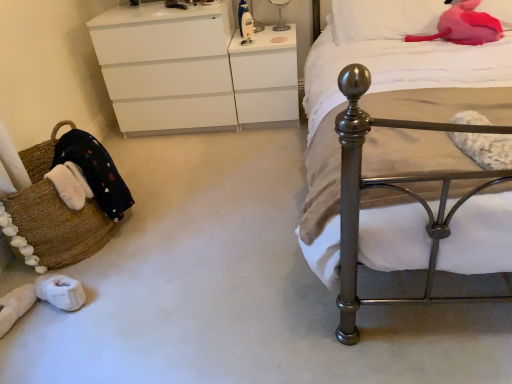
Find the location of a particular element. white glossy changing table at upper center is located at coordinates (265, 78).

Describe the element at coordinates (402, 150) in the screenshot. I see `polished metal bed at right` at that location.

Where is `white matte chest of drawers at upper left`? The image size is (512, 384). white matte chest of drawers at upper left is located at coordinates (191, 71).

From a real-world perspective, count 1st pillows upward from the polished metal bed at right and point to it. Please provide its 2D coordinates.

[(498, 11)]

Would you say pink plush pillow at upper right, which is the first pillow from right to left, contains polished metal bed at right?

Definitely not — polished metal bed at right is not inside pink plush pillow at upper right, which is the first pillow from right to left.

From a real-world perspective, relative to polished metal bed at right, is pink plush pillow at upper right, marked as the second pillow in a left-to-right arrangement, vertically above or below?

pink plush pillow at upper right, marked as the second pillow in a left-to-right arrangement, is situated higher than polished metal bed at right in the real world.

Would you say white glossy changing table at upper center is to the left or to the right of polished metal bed at right in the picture?

white glossy changing table at upper center is to the left of polished metal bed at right.

Is white glossy changing table at upper center spatially inside polished metal bed at right, or outside of it?

white glossy changing table at upper center is outside polished metal bed at right.

Which object is thinner, white glossy changing table at upper center or polished metal bed at right?

white glossy changing table at upper center is thinner.

Is white glossy changing table at upper center smaller than polished metal bed at right?

Correct, white glossy changing table at upper center occupies less space than polished metal bed at right.

Consider the image. Considering the relative positions of transparent glass lamp at upper center and polished metal bed at right in the image provided, is transparent glass lamp at upper center in front of polished metal bed at right?

No, it is behind polished metal bed at right.

Which is more to the left, transparent glass lamp at upper center or polished metal bed at right?

From the viewer's perspective, transparent glass lamp at upper center appears more on the left side.

From a real-world perspective, is transparent glass lamp at upper center on polished metal bed at right?

Correct, in the physical world, transparent glass lamp at upper center is higher than polished metal bed at right.

Would you say transparent glass lamp at upper center contains polished metal bed at right?

That's incorrect, polished metal bed at right is not inside transparent glass lamp at upper center.

From the image's perspective, which is below, transparent glass lamp at upper center or white glossy changing table at upper center?

white glossy changing table at upper center, from the image's perspective.

Is transparent glass lamp at upper center not within white glossy changing table at upper center?

Indeed, transparent glass lamp at upper center is completely outside white glossy changing table at upper center.

Is white glossy changing table at upper center at the back of transparent glass lamp at upper center?

No, transparent glass lamp at upper center is not facing the opposite direction of white glossy changing table at upper center.

Which is more to the right, transparent glass lamp at upper center or white glossy changing table at upper center?

transparent glass lamp at upper center.

Can you confirm if pink plush at upper right, placed as the second pillow when sorted from right to left, is taller than polished metal bed at right?

In fact, pink plush at upper right, placed as the second pillow when sorted from right to left, may be shorter than polished metal bed at right.

Is pink plush at upper right, placed as the second pillow when sorted from right to left, bigger or smaller than polished metal bed at right?

In the image, pink plush at upper right, placed as the second pillow when sorted from right to left, appears to be smaller than polished metal bed at right.

Consider the image. Which is nearer, (410, 33) or (337, 250)?

Point (410, 33) is positioned farther from the camera compared to point (337, 250).

From the image's perspective, who appears lower, pink plush at upper right, positioned as the 1th pillow in left-to-right order, or polished metal bed at right?

polished metal bed at right appears lower in the image.

In the scene shown: Is pink plush at upper right, placed as the second pillow when sorted from right to left, far from transparent glass lamp at upper center?

They are positioned close to each other.

Which of these two, pink plush at upper right, placed as the second pillow when sorted from right to left, or transparent glass lamp at upper center, stands taller?

transparent glass lamp at upper center.

Looking at this image, can you confirm if pink plush at upper right, positioned as the 1th pillow in left-to-right order, is thinner than transparent glass lamp at upper center?

No.

Measure the distance between pink plush at upper right, positioned as the 1th pillow in left-to-right order, and transparent glass lamp at upper center.

pink plush at upper right, positioned as the 1th pillow in left-to-right order, is 24.52 inches from transparent glass lamp at upper center.

Considering the positions of points (419, 30) and (284, 91), is point (419, 30) farther from camera compared to point (284, 91)?

No, it is in front of (284, 91).

Is pink plush at upper right, placed as the second pillow when sorted from right to left, not near white glossy changing table at upper center?

No, pink plush at upper right, placed as the second pillow when sorted from right to left, is not far from white glossy changing table at upper center.

Between pink plush at upper right, placed as the second pillow when sorted from right to left, and white glossy changing table at upper center, which one is positioned behind?

white glossy changing table at upper center is behind.

From a real-world perspective, which is physically above, pink plush at upper right, placed as the second pillow when sorted from right to left, or white glossy changing table at upper center?

pink plush at upper right, placed as the second pillow when sorted from right to left.

Find the location of a particular element. The image size is (512, 384). the 1st pillow behind when counting from the polished metal bed at right is located at coordinates (498, 11).

Locate an element on the screen. The height and width of the screenshot is (384, 512). changing table directly beneath the polished metal bed at right (from a real-world perspective) is located at coordinates (265, 78).

Which object lies nearer to the anchor point white glossy changing table at upper center, transparent glass lamp at upper center or brown woven basket at lower left?

Based on the image, transparent glass lamp at upper center appears to be nearer to white glossy changing table at upper center.

When comparing their distances from polished metal bed at right, does brown woven basket at lower left or white matte chest of drawers at upper left seem closer?

Based on the image, white matte chest of drawers at upper left appears to be nearer to polished metal bed at right.

Based on the photo, based on their spatial positions, is polished metal bed at right or white glossy changing table at upper center closer to brown woven basket at lower left?

Among the two, white glossy changing table at upper center is located nearer to brown woven basket at lower left.

Estimate the real-world distances between objects in this image. Which object is further from white glossy changing table at upper center, brown woven basket at lower left or pink plush pillow at upper right, which is the first pillow from right to left?

brown woven basket at lower left is further to white glossy changing table at upper center.

When comparing their distances from pink plush pillow at upper right, marked as the second pillow in a left-to-right arrangement, does polished metal bed at right or transparent glass lamp at upper center seem closer?

polished metal bed at right is positioned closer to the anchor pink plush pillow at upper right, marked as the second pillow in a left-to-right arrangement.

Which object lies nearer to the anchor point white matte chest of drawers at upper left, polished metal bed at right or pink plush pillow at upper right, which is the first pillow from right to left?

Among the two, polished metal bed at right is located nearer to white matte chest of drawers at upper left.

Based on their spatial positions, is pink plush pillow at upper right, which is the first pillow from right to left, or brown woven basket at lower left further from white glossy changing table at upper center?

The object further to white glossy changing table at upper center is brown woven basket at lower left.

From the picture: Which object lies further to the anchor point white glossy changing table at upper center, brown woven basket at lower left or transparent glass lamp at upper center?

brown woven basket at lower left is positioned further to the anchor white glossy changing table at upper center.

Identify the location of the chest of drawers that lies between transparent glass lamp at upper center and brown woven basket at lower left from top to bottom. (191, 71).

You are a GUI agent. You are given a task and a screenshot of the screen. Output one action in this format:
    pyautogui.click(x=<x>, y=<y>)
    Task: Click on the chest of drawers between brown woven basket at lower left and white glossy changing table at upper center along the z-axis
    This screenshot has width=512, height=384.
    Given the screenshot: What is the action you would take?
    pyautogui.click(x=191, y=71)

I want to click on pillow between polished metal bed at right and pink plush at upper right, positioned as the 1th pillow in left-to-right order, from front to back, so click(x=498, y=11).

Locate an element on the screen. The image size is (512, 384). changing table between polished metal bed at right and transparent glass lamp at upper center along the z-axis is located at coordinates (265, 78).